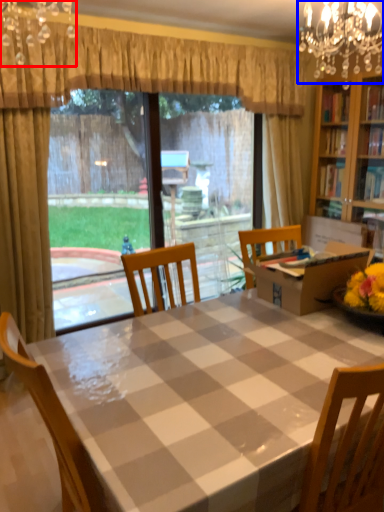
Question: Which of the following is the farthest to the observer, light fixture (highlighted by a red box) or light fixture (highlighted by a blue box)?

Choices:
 (A) light fixture
 (B) light fixture

Answer: (B)